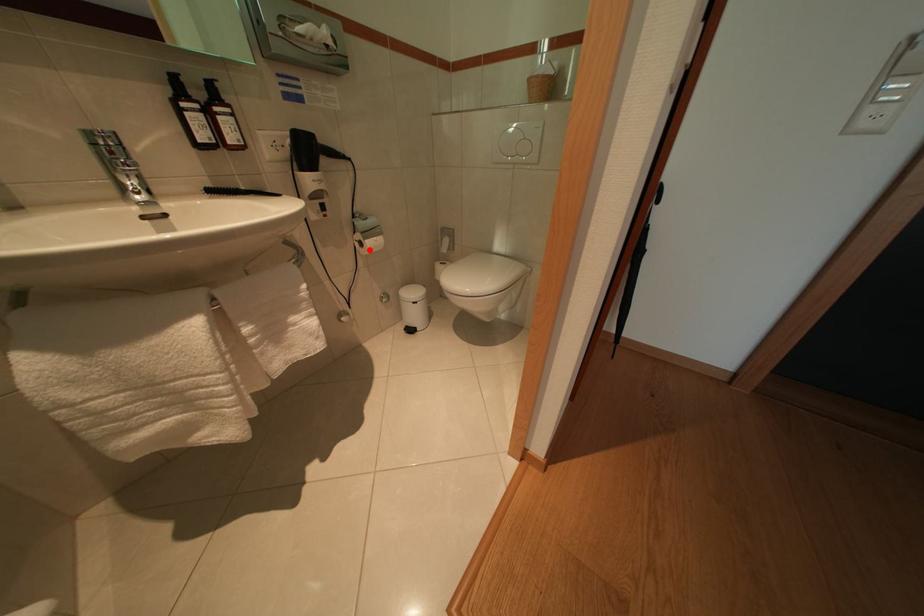
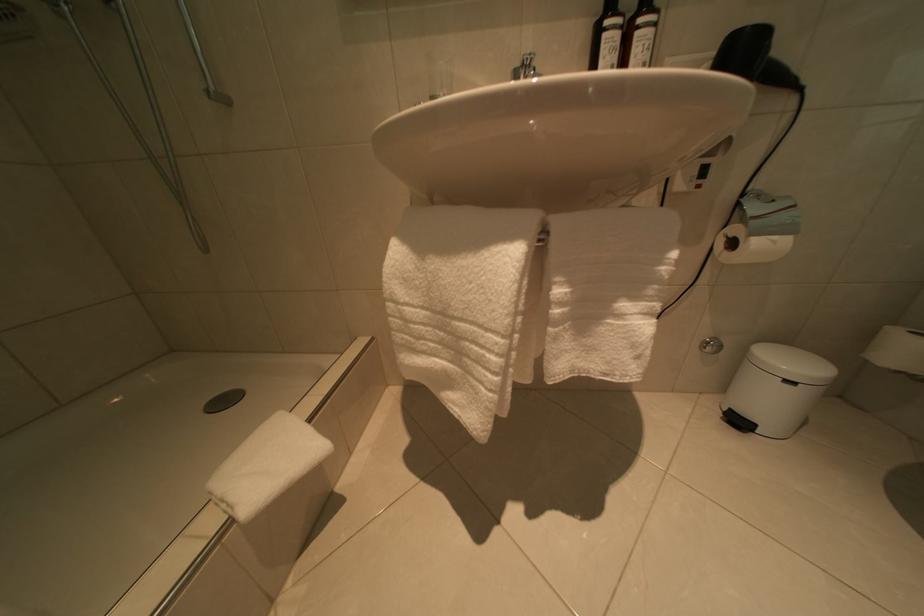
The point at the highlighted location is marked in the first image. Where is the corresponding point in the second image?

(740, 249)